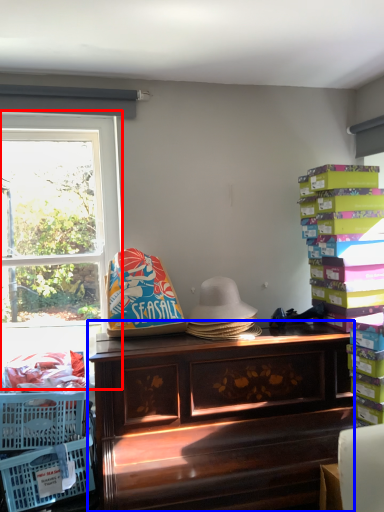
Question: Among these objects, which one is farthest to the camera, window (highlighted by a red box) or desk (highlighted by a blue box)?

Choices:
 (A) window
 (B) desk

Answer: (A)